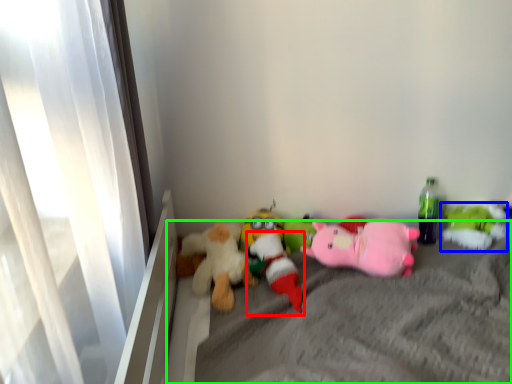
Question: Considering the real-world distances, which object is farthest from toy (highlighted by a red box)? toy (highlighted by a blue box) or mattress (highlighted by a green box)?

Choices:
 (A) toy
 (B) mattress

Answer: (A)